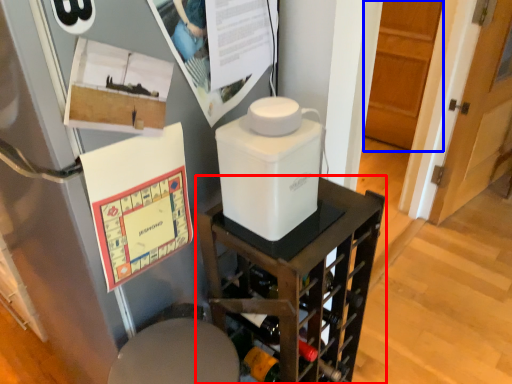
Question: Which point is further to the camera, furniture (highlighted by a red box) or door (highlighted by a blue box)?

Choices:
 (A) furniture
 (B) door

Answer: (B)